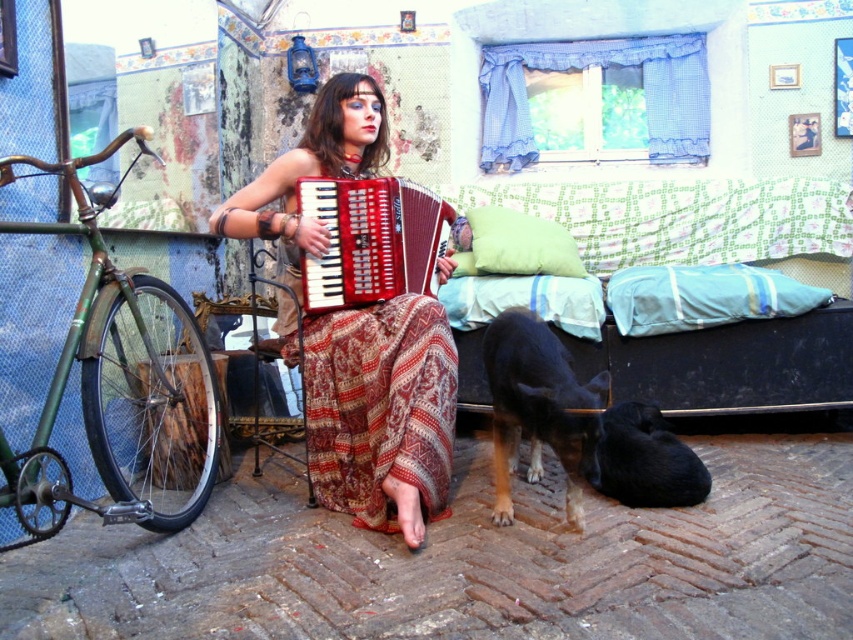
You are a photographer setting up a shoot in this room. You want to place a small stool between the green matte bicycle at left and the red glossy accordion at center. Based on their positions, where should you position the stool?

The green matte bicycle at left is located below the red glossy accordion at center, so the stool should be placed between them horizontally, aligning with the bicycle on the left and the accordion at center.

You are a visitor in this room and want to place a small plant between the green matte bicycle at left and the red glossy accordion at center. Based on their positions, where should you place the plant to ensure it is between them?

The green matte bicycle at left is positioned on the left side of the red glossy accordion at center, so placing the plant to the right of the green matte bicycle at left and to the left of the red glossy accordion at center would place it between them.